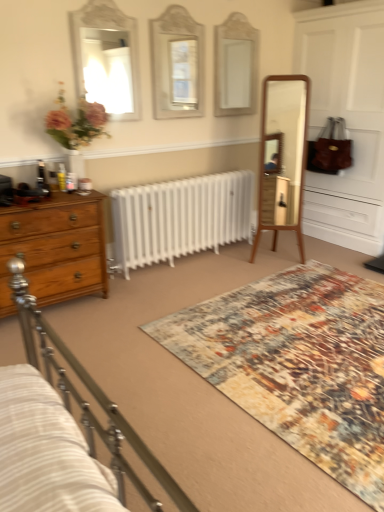
This screenshot has height=512, width=384. I want to click on blank space above white glass mirror at upper center, arranged as the third mirror when viewed from the left (from a real-world perspective), so click(237, 10).